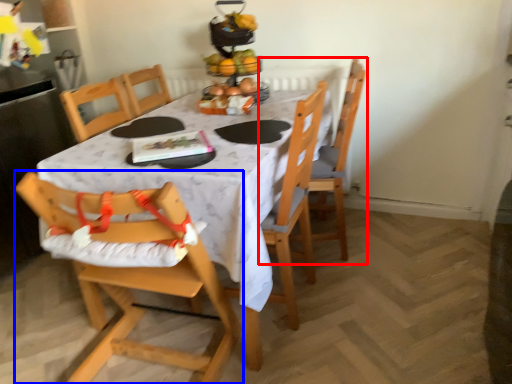
Question: Which object is closer to the camera taking this photo, chair (highlighted by a red box) or chair (highlighted by a blue box)?

Choices:
 (A) chair
 (B) chair

Answer: (B)